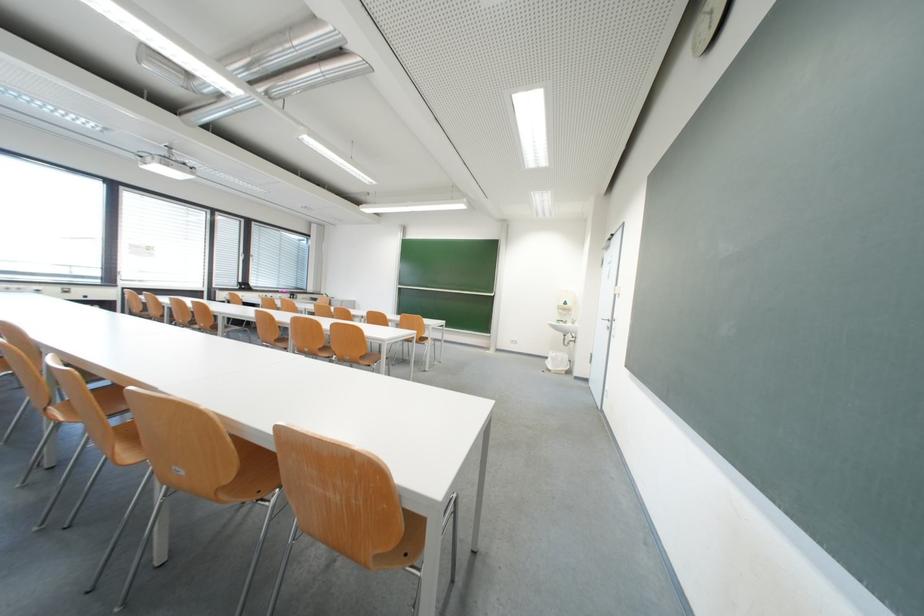
The image size is (924, 616). Describe the element at coordinates (565, 328) in the screenshot. I see `a soap dispenser button` at that location.